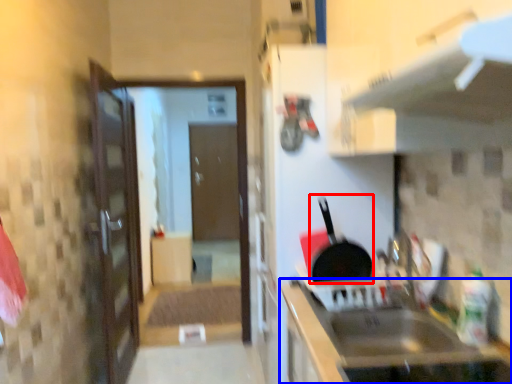
Question: Which of the following is the farthest to the observer, frying pan (highlighted by a red box) or cabinetry (highlighted by a blue box)?

Choices:
 (A) frying pan
 (B) cabinetry

Answer: (A)